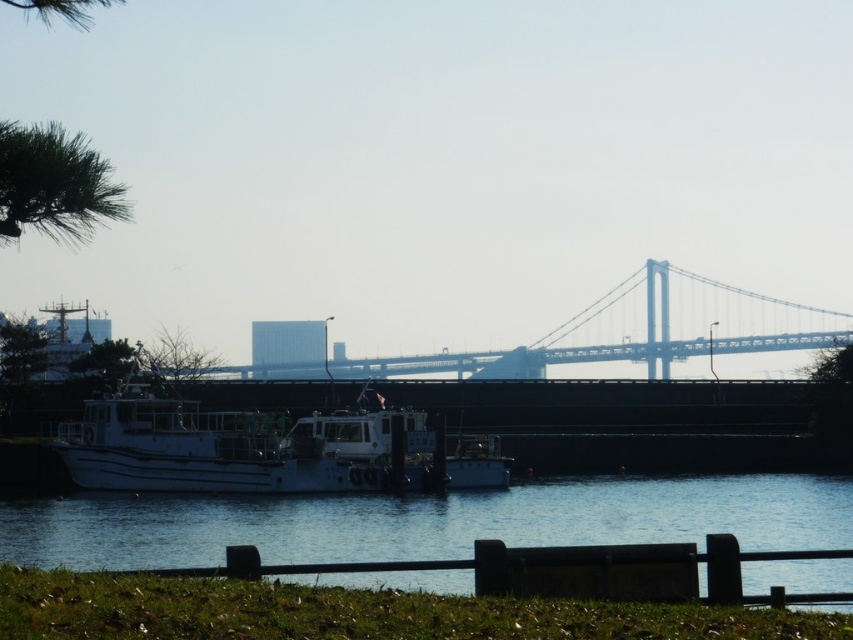
Question: Which of the following is the farthest from the observer?

Choices:
 (A) metallic gray bridge at center
 (B) white matte boat at lower left
 (C) blue water at lower center

Answer: (A)

Question: Does blue water at lower center lie behind metallic gray bridge at center?

Choices:
 (A) no
 (B) yes

Answer: (A)

Question: Is white matte boat at lower left below metallic gray bridge at center?

Choices:
 (A) no
 (B) yes

Answer: (B)

Question: Estimate the real-world distances between objects in this image. Which object is closer to the blue water at lower center?

Choices:
 (A) white matte boat at lower left
 (B) metallic gray bridge at center

Answer: (A)

Question: Considering the real-world distances, which object is farthest from the metallic gray bridge at center?

Choices:
 (A) blue water at lower center
 (B) white matte boat at lower left

Answer: (A)

Question: Can you confirm if white matte boat at lower left is thinner than metallic gray bridge at center?

Choices:
 (A) no
 (B) yes

Answer: (B)